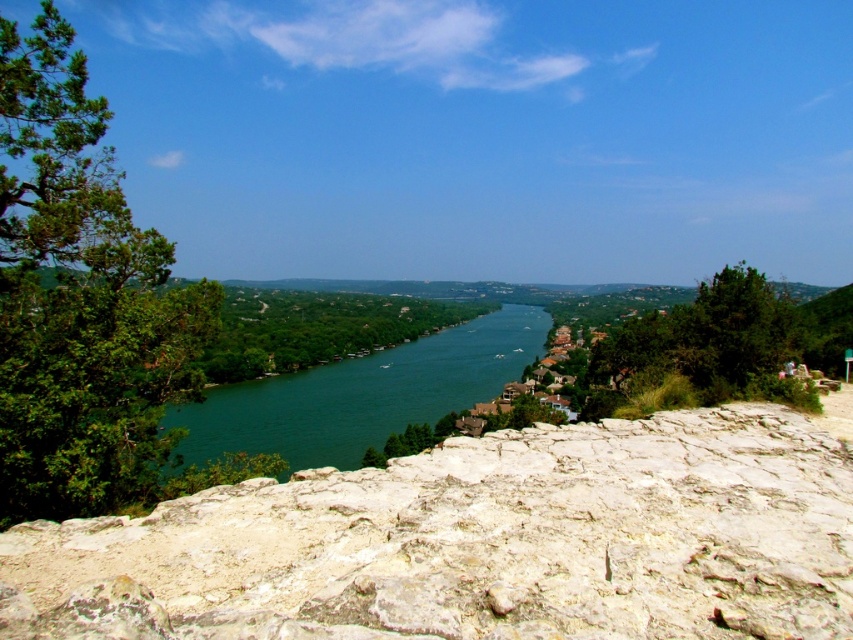
Question: Is white rocky cliff at center behind green smooth water at center?

Choices:
 (A) no
 (B) yes

Answer: (A)

Question: Which object is farther from the camera taking this photo?

Choices:
 (A) green smooth water at center
 (B) white rocky cliff at center

Answer: (A)

Question: Which point is farther from the camera taking this photo?

Choices:
 (A) (189, 429)
 (B) (234, 616)

Answer: (A)

Question: Is white rocky cliff at center wider than green smooth water at center?

Choices:
 (A) no
 (B) yes

Answer: (A)

Question: Among these objects, which one is nearest to the camera?

Choices:
 (A) white rocky cliff at center
 (B) green smooth water at center

Answer: (A)

Question: Can you confirm if white rocky cliff at center is positioned to the left of green smooth water at center?

Choices:
 (A) yes
 (B) no

Answer: (B)